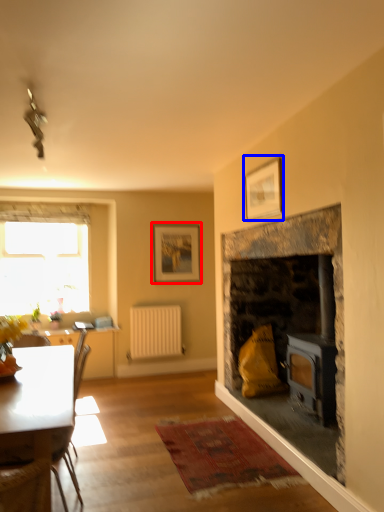
Question: Which point is closer to the camera, picture frame (highlighted by a red box) or picture frame (highlighted by a blue box)?

Choices:
 (A) picture frame
 (B) picture frame

Answer: (B)